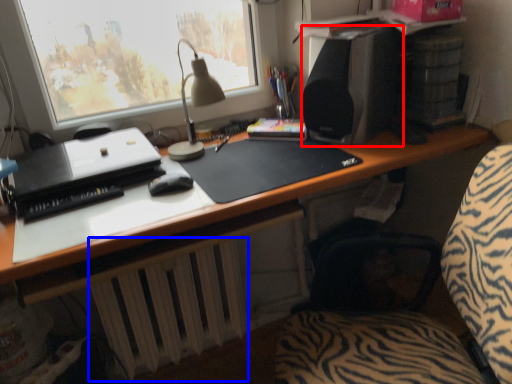
Question: Which of the following is the farthest to the observer, loudspeaker (highlighted by a red box) or radiator (highlighted by a blue box)?

Choices:
 (A) loudspeaker
 (B) radiator

Answer: (B)